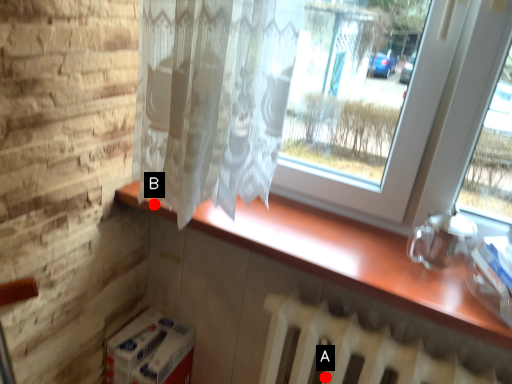
Question: Two points are circled on the image, labeled by A and B beside each circle. Which of the following is the closest to the observer?

Choices:
 (A) A is closer
 (B) B is closer

Answer: (A)